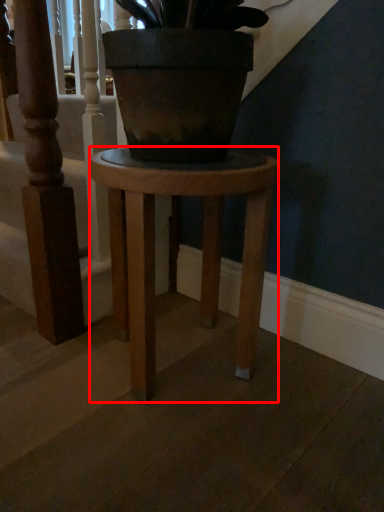
Question: From the image's perspective, what is the correct spatial positioning of stool (annotated by the red box) in reference to stairwell?

Choices:
 (A) below
 (B) above

Answer: (A)